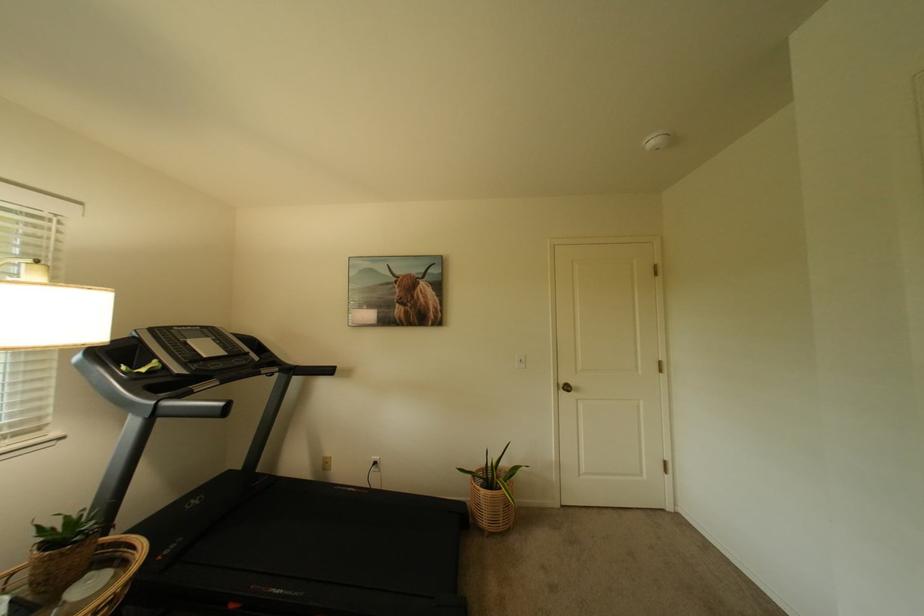
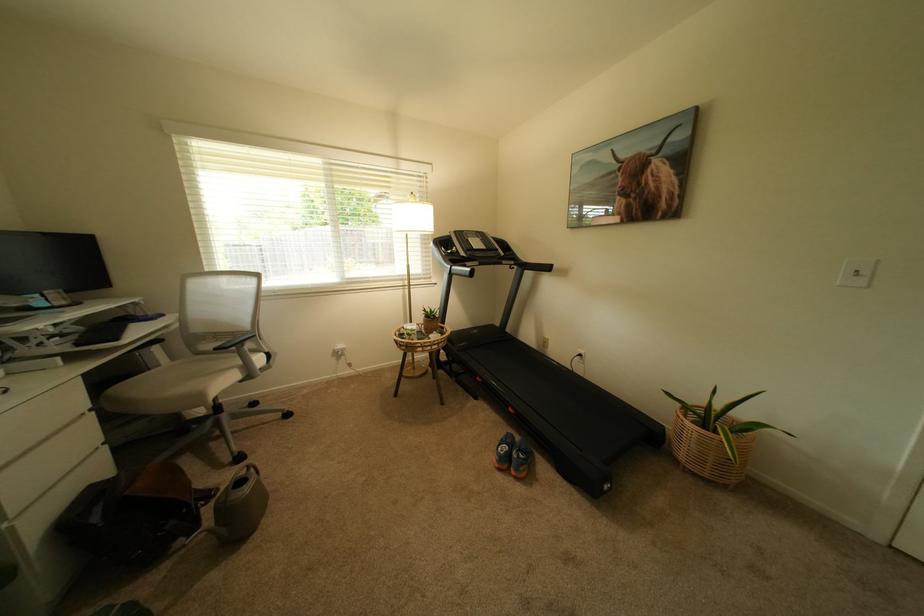
Where in the second image is the point corresponding to point (295, 377) from the first image?

(529, 270)